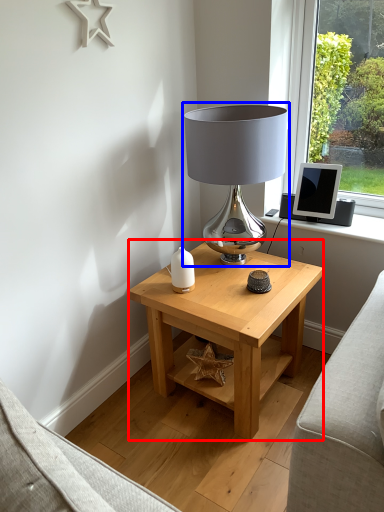
Question: Which object appears farthest to the camera in this image, table (highlighted by a red box) or lamp (highlighted by a blue box)?

Choices:
 (A) table
 (B) lamp

Answer: (B)